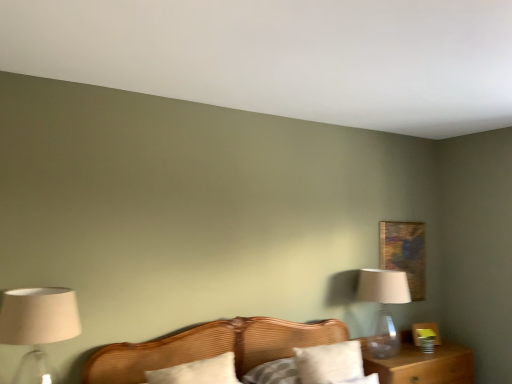
What do you see at coordinates (197, 372) in the screenshot? The width and height of the screenshot is (512, 384). I see `white soft pillow at center, the 2th pillow in the right-to-left sequence` at bounding box center [197, 372].

Locate an element on the screen. This screenshot has width=512, height=384. white soft pillow at center, the 2th pillow in the right-to-left sequence is located at coordinates (197, 372).

This screenshot has height=384, width=512. What do you see at coordinates (422, 365) in the screenshot?
I see `brown wooden nightstand at lower right` at bounding box center [422, 365].

At what (x,y) coordinates should I click in order to perform the action: click on wooden picture frame at upper right. Please return your answer as a coordinate pair (x, y). This screenshot has height=384, width=512. Looking at the image, I should click on (404, 253).

Locate an element on the screen. The height and width of the screenshot is (384, 512). white cotton pillow at center, which appears as the 1th pillow when viewed from the right is located at coordinates (329, 363).

Image resolution: width=512 pixels, height=384 pixels. Identify the location of wooden bed at center. click(210, 347).

Find the location of `white soft pillow at center, marked as the first pillow in a left-to-right arrangement`. white soft pillow at center, marked as the first pillow in a left-to-right arrangement is located at coordinates (197, 372).

Between wooden bed at center and brown wooden nightstand at lower right, which one has larger size?

With larger size is wooden bed at center.

Is wooden bed at center taller or shorter than brown wooden nightstand at lower right?

Considering their sizes, wooden bed at center has more height than brown wooden nightstand at lower right.

Can you confirm if wooden bed at center is positioned to the right of brown wooden nightstand at lower right?

Incorrect, wooden bed at center is not on the right side of brown wooden nightstand at lower right.

In the scene shown: From a real-world perspective, is wooden bed at center on top of brown wooden nightstand at lower right?

Yes, from a real-world perspective, wooden bed at center is above brown wooden nightstand at lower right.

Is wooden bed at center looking in the opposite direction of white soft pillow at center, the 2th pillow in the right-to-left sequence?

Absolutely, wooden bed at center is directed away from white soft pillow at center, the 2th pillow in the right-to-left sequence.

Considering the positions of objects wooden bed at center and white soft pillow at center, marked as the first pillow in a left-to-right arrangement, in the image provided, who is more to the right, wooden bed at center or white soft pillow at center, marked as the first pillow in a left-to-right arrangement,?

wooden bed at center is more to the right.

What's the angular difference between wooden bed at center and white soft pillow at center, the 2th pillow in the right-to-left sequence,'s facing directions?

2.3 degrees separate the facing orientations of wooden bed at center and white soft pillow at center, the 2th pillow in the right-to-left sequence.

Considering their positions, is wooden bed at center located in front of or behind white soft pillow at center, the 2th pillow in the right-to-left sequence?

wooden bed at center is positioned closer to the viewer than white soft pillow at center, the 2th pillow in the right-to-left sequence.

Considering the relative sizes of brown wooden nightstand at lower right and wooden picture frame at upper right in the image provided, is brown wooden nightstand at lower right wider than wooden picture frame at upper right?

Yes, brown wooden nightstand at lower right is wider than wooden picture frame at upper right.

You are a GUI agent. You are given a task and a screenshot of the screen. Output one action in this format:
    pyautogui.click(x=<x>, y=<y>)
    Task: Click on the nightstand below the wooden picture frame at upper right (from a real-world perspective)
    The width and height of the screenshot is (512, 384).
    Given the screenshot: What is the action you would take?
    pyautogui.click(x=422, y=365)

How many degrees apart are the facing directions of brown wooden nightstand at lower right and wooden picture frame at upper right?

They differ by 0.962 degrees in their facing directions.

Is brown wooden nightstand at lower right positioned with its back to wooden picture frame at upper right?

No.

How different are the orientations of wooden picture frame at upper right and brown wooden nightstand at lower right in degrees?

0.962 degrees.

Is wooden picture frame at upper right further to camera compared to brown wooden nightstand at lower right?

Yes.

From a real-world perspective, is wooden picture frame at upper right under brown wooden nightstand at lower right?

No.

Between wooden picture frame at upper right and brown wooden nightstand at lower right, which one has smaller width?

Thinner between the two is wooden picture frame at upper right.

Considering the positions of objects matte beige lampshade at left and transparent glass table lamp at right in the image provided, who is more to the right, matte beige lampshade at left or transparent glass table lamp at right?

transparent glass table lamp at right is more to the right.

Considering their positions, is matte beige lampshade at left located in front of or behind transparent glass table lamp at right?

Visually, matte beige lampshade at left is located in front of transparent glass table lamp at right.

Looking at their sizes, would you say matte beige lampshade at left is wider or thinner than transparent glass table lamp at right?

Considering their sizes, matte beige lampshade at left looks slimmer than transparent glass table lamp at right.

Which point is more distant from viewer, (29, 332) or (370, 298)?

The point (370, 298) is farther from the camera.

Is wooden bed at center thinner than wooden picture frame at upper right?

No, wooden bed at center is not thinner than wooden picture frame at upper right.

Between wooden bed at center and wooden picture frame at upper right, which one appears on the left side from the viewer's perspective?

From the viewer's perspective, wooden bed at center appears more on the left side.

From a real-world perspective, is wooden bed at center physically located above or below wooden picture frame at upper right?

wooden bed at center is situated lower than wooden picture frame at upper right in the real world.

From the image's perspective, which object appears higher, wooden bed at center or wooden picture frame at upper right?

wooden picture frame at upper right is shown above in the image.

Looking at their sizes, would you say wooden bed at center is wider or thinner than white cotton pillow at center, which appears as the 1th pillow when viewed from the right?

Clearly, wooden bed at center has more width compared to white cotton pillow at center, which appears as the 1th pillow when viewed from the right.

Could you tell me if wooden bed at center is turned towards white cotton pillow at center, which appears as the 1th pillow when viewed from the right?

No, wooden bed at center is not oriented towards white cotton pillow at center, which appears as the 1th pillow when viewed from the right.

Measure the distance between wooden bed at center and white cotton pillow at center, which appears as the 1th pillow when viewed from the right.

They are 19.35 inches apart.

From the image's perspective, which one is positioned higher, wooden bed at center or white cotton pillow at center, the 2th pillow in the left-to-right sequence?

white cotton pillow at center, the 2th pillow in the left-to-right sequence, from the image's perspective.

At what (x,y) coordinates should I click in order to perform the action: click on bed above the brown wooden nightstand at lower right (from a real-world perspective). Please return your answer as a coordinate pair (x, y). This screenshot has height=384, width=512. Looking at the image, I should click on (210, 347).

At what (x,y) coordinates should I click in order to perform the action: click on bed in front of the white soft pillow at center, marked as the first pillow in a left-to-right arrangement. Please return your answer as a coordinate pair (x, y). The image size is (512, 384). Looking at the image, I should click on (210, 347).

When comparing their distances from wooden bed at center, does brown wooden nightstand at lower right or white cotton pillow at center, which appears as the 1th pillow when viewed from the right, seem further?

brown wooden nightstand at lower right lies further to wooden bed at center than the other object.

Estimate the real-world distances between objects in this image. Which object is closer to matte beige lampshade at left, wooden bed at center or wooden picture frame at upper right?

wooden bed at center is positioned closer to the anchor matte beige lampshade at left.

Estimate the real-world distances between objects in this image. Which object is closer to matte beige lampshade at left, transparent glass table lamp at right or white cotton pillow at center, which appears as the 1th pillow when viewed from the right?

white cotton pillow at center, which appears as the 1th pillow when viewed from the right, is positioned closer to the anchor matte beige lampshade at left.

From the image, which object appears to be farther from transparent glass table lamp at right, wooden picture frame at upper right or wooden bed at center?

wooden bed at center is further to transparent glass table lamp at right.

Based on their spatial positions, is transparent glass table lamp at right or wooden picture frame at upper right closer to wooden bed at center?

transparent glass table lamp at right is closer to wooden bed at center.

Estimate the real-world distances between objects in this image. Which object is closer to wooden bed at center, white cotton pillow at center, the 2th pillow in the left-to-right sequence, or matte beige lampshade at left?

Based on the image, white cotton pillow at center, the 2th pillow in the left-to-right sequence, appears to be nearer to wooden bed at center.

Considering their positions, is brown wooden nightstand at lower right positioned further to white cotton pillow at center, which appears as the 1th pillow when viewed from the right, than matte beige lampshade at left?

The object further to white cotton pillow at center, which appears as the 1th pillow when viewed from the right, is matte beige lampshade at left.

Estimate the real-world distances between objects in this image. Which object is further from brown wooden nightstand at lower right, wooden picture frame at upper right or white soft pillow at center, the 2th pillow in the right-to-left sequence?

The object further to brown wooden nightstand at lower right is white soft pillow at center, the 2th pillow in the right-to-left sequence.

You are a GUI agent. You are given a task and a screenshot of the screen. Output one action in this format:
    pyautogui.click(x=<x>, y=<y>)
    Task: Click on the lamp between wooden bed at center and wooden picture frame at upper right along the z-axis
    This screenshot has height=384, width=512.
    Given the screenshot: What is the action you would take?
    pyautogui.click(x=37, y=326)

I want to click on bed located between matte beige lampshade at left and transparent glass table lamp at right in the left-right direction, so click(210, 347).

The width and height of the screenshot is (512, 384). What are the coordinates of `table lamp between white cotton pillow at center, which appears as the 1th pillow when viewed from the right, and wooden picture frame at upper right, along the z-axis` in the screenshot? It's located at (383, 307).

I want to click on nightstand between wooden bed at center and wooden picture frame at upper right from front to back, so click(x=422, y=365).